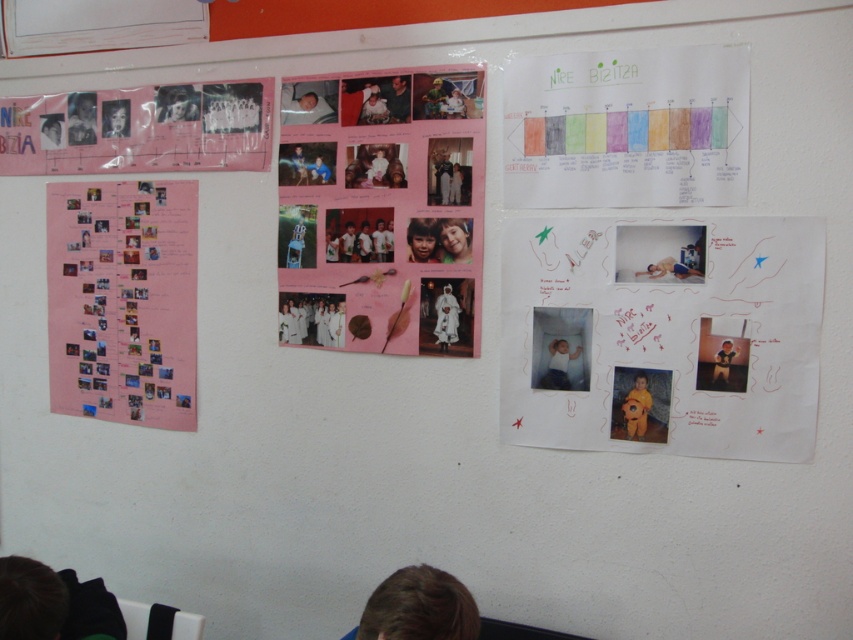
Question: Does white paper at center have a larger size compared to pink paper poster at left?

Choices:
 (A) yes
 (B) no

Answer: (B)

Question: Which of the following is the farthest from the observer?

Choices:
 (A) (674, 433)
 (B) (115, 202)

Answer: (B)

Question: Is pink paper collage at center closer to the viewer compared to watercolor paper chart at upper right?

Choices:
 (A) no
 (B) yes

Answer: (A)

Question: Which point appears closest to the camera in this image?

Choices:
 (A) (105, 371)
 (B) (756, 300)
 (C) (666, 166)
 (D) (219, 102)

Answer: (B)

Question: Observing the image, what is the correct spatial positioning of watercolor paper chart at upper right in reference to matte pink poster at upper left?

Choices:
 (A) below
 (B) above

Answer: (A)

Question: Which object is closer to the camera taking this photo?

Choices:
 (A) matte pink poster at upper left
 (B) pink paper collage at center
 (C) pink paper poster at left
 (D) watercolor paper chart at upper right

Answer: (D)